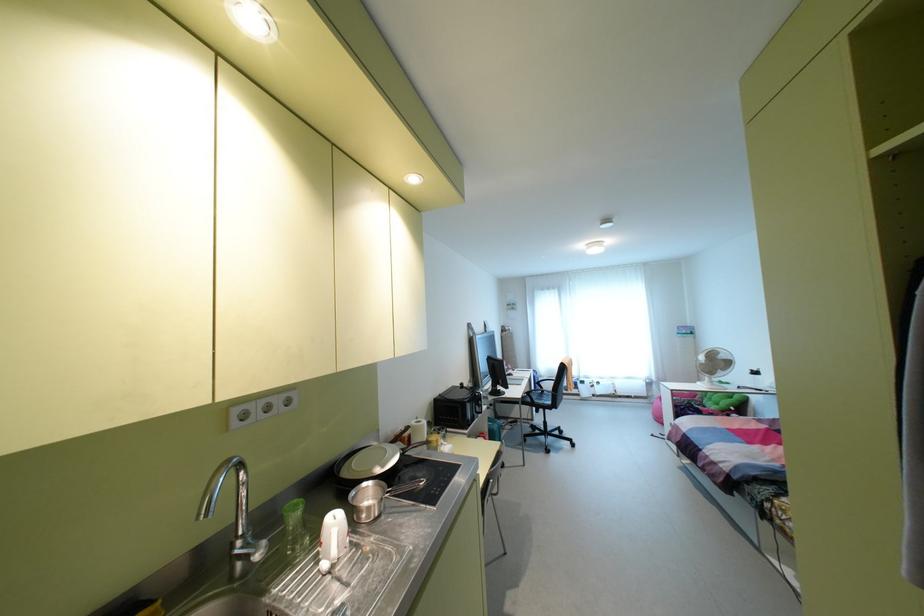
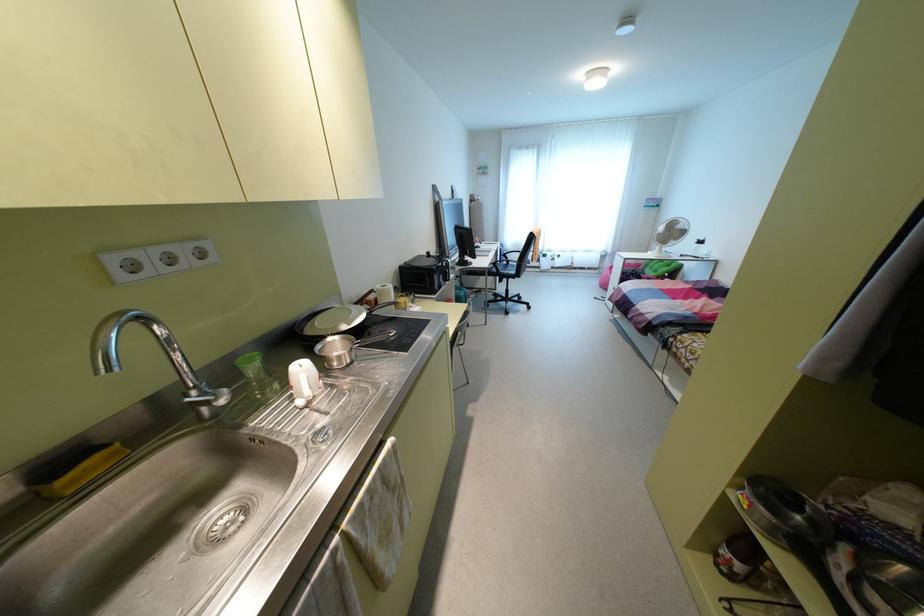
Find the pixel in the second image that matches point (548, 402) in the first image.

(513, 272)